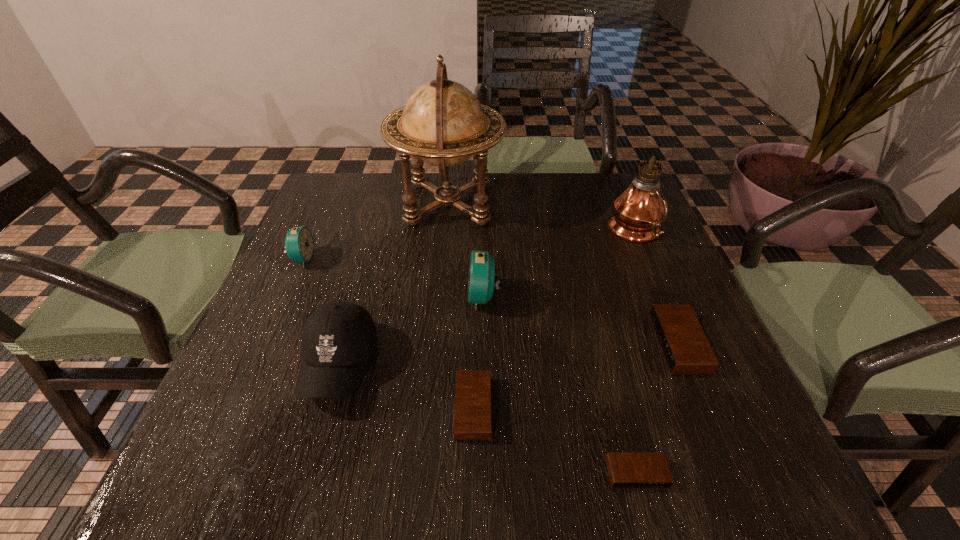
Image resolution: width=960 pixels, height=540 pixels. I want to click on globe, so [442, 123].

Find the location of a particular element. oil lamp is located at coordinates (638, 212).

Image resolution: width=960 pixels, height=540 pixels. In order to click on the right blue alarm clock in this screenshot , I will do `click(481, 278)`.

Find the location of a particular element. the nearer blue alarm clock is located at coordinates (481, 278).

Locate an element on the screen. baseball cap is located at coordinates (338, 338).

Identify the location of the leftmost alarm clock. This screenshot has width=960, height=540. (299, 244).

The width and height of the screenshot is (960, 540). I want to click on the leftmost object, so click(x=299, y=244).

Find the location of `the rightmost black alarm clock`. the rightmost black alarm clock is located at coordinates (686, 350).

This screenshot has width=960, height=540. What are the coordinates of `the sixth tallest object` in the screenshot? It's located at (686, 350).

Where is `the seventh tallest object`? This screenshot has height=540, width=960. the seventh tallest object is located at coordinates (472, 416).